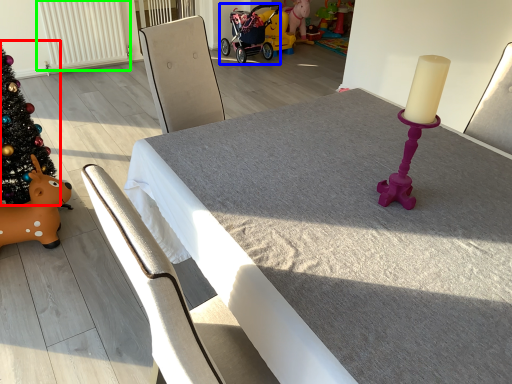
Question: Which object is positioned farthest from christmas tree (highlighted by a red box)? Select from baby carriage (highlighted by a blue box) and radiator (highlighted by a green box).

Choices:
 (A) baby carriage
 (B) radiator

Answer: (A)